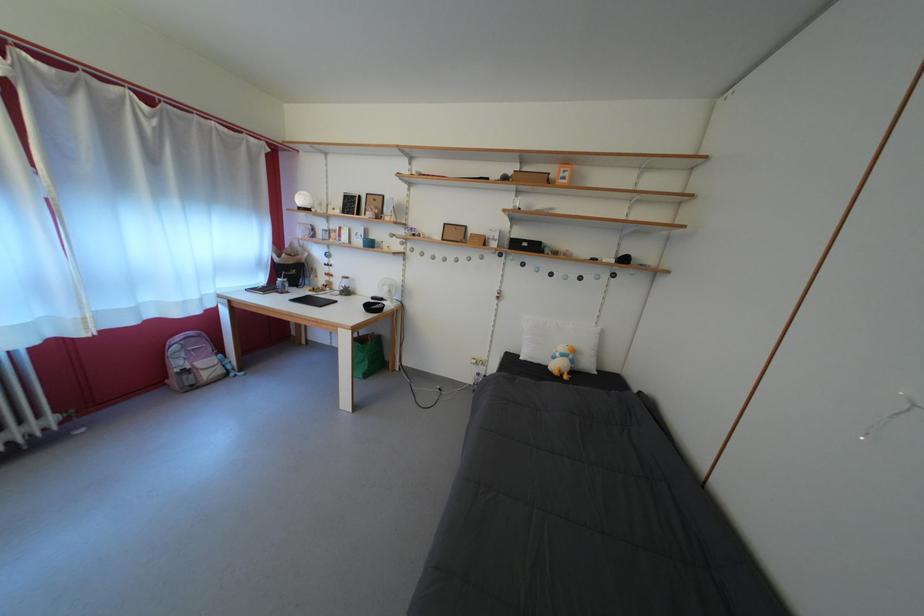
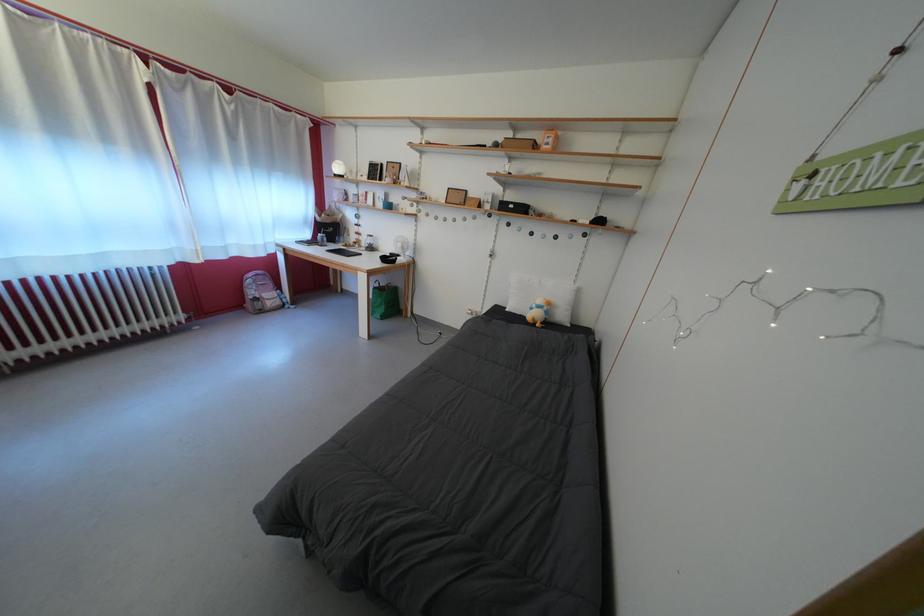
Where in the second image is the point corresponding to point (533, 176) from the first image?

(527, 142)